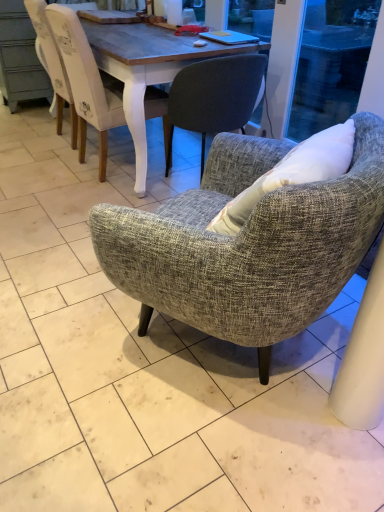
Question: Is white painted wood chair at upper left, which is the first chair in back-to-front order, oriented away from textured gray armchair at center, the first chair in the front-to-back sequence?

Choices:
 (A) no
 (B) yes

Answer: (A)

Question: From the image's perspective, is white painted wood chair at upper left, which is the first chair in back-to-front order, on textured gray armchair at center, the first chair in the front-to-back sequence?

Choices:
 (A) yes
 (B) no

Answer: (A)

Question: Is white painted wood chair at upper left, the 3th chair in the front-to-back sequence, positioned far away from textured gray armchair at center, the first chair in the front-to-back sequence?

Choices:
 (A) no
 (B) yes

Answer: (B)

Question: Can you confirm if white painted wood chair at upper left, which is the first chair in back-to-front order, is shorter than textured gray armchair at center, the 3th chair when ordered from back to front?

Choices:
 (A) no
 (B) yes

Answer: (A)

Question: From a real-world perspective, is white painted wood chair at upper left, the 3th chair in the front-to-back sequence, positioned over textured gray armchair at center, the 3th chair when ordered from back to front, based on gravity?

Choices:
 (A) no
 (B) yes

Answer: (A)

Question: Is white painted wood chair at upper left, which is the first chair in back-to-front order, further to the viewer compared to textured gray armchair at center, the 3th chair when ordered from back to front?

Choices:
 (A) no
 (B) yes

Answer: (B)

Question: Can you confirm if textured gray armchair at center, the 3th chair when ordered from back to front, is wider than textured gray armchair at center, the 2th chair when ordered from back to front?

Choices:
 (A) no
 (B) yes

Answer: (A)

Question: Can you confirm if textured gray armchair at center, the 3th chair when ordered from back to front, is bigger than textured gray armchair at center, which ranks as the second chair in front-to-back order?

Choices:
 (A) yes
 (B) no

Answer: (B)

Question: Is textured gray armchair at center, which ranks as the second chair in front-to-back order, surrounded by textured gray armchair at center, the 3th chair when ordered from back to front?

Choices:
 (A) yes
 (B) no

Answer: (B)

Question: Considering the relative sizes of textured gray armchair at center, the first chair in the front-to-back sequence, and textured gray armchair at center, the 2th chair when ordered from back to front, in the image provided, is textured gray armchair at center, the first chair in the front-to-back sequence, taller than textured gray armchair at center, the 2th chair when ordered from back to front,?

Choices:
 (A) yes
 (B) no

Answer: (B)

Question: Is textured gray armchair at center, the 3th chair when ordered from back to front, closer to the viewer compared to textured gray armchair at center, which ranks as the second chair in front-to-back order?

Choices:
 (A) no
 (B) yes

Answer: (B)

Question: From a real-world perspective, is textured gray armchair at center, the 3th chair when ordered from back to front, located higher than textured gray armchair at center, the 2th chair when ordered from back to front?

Choices:
 (A) yes
 (B) no

Answer: (A)

Question: From a real-world perspective, is textured gray armchair at center, the first chair in the front-to-back sequence, physically above white painted wood chair at upper left, which is the first chair in back-to-front order?

Choices:
 (A) yes
 (B) no

Answer: (A)